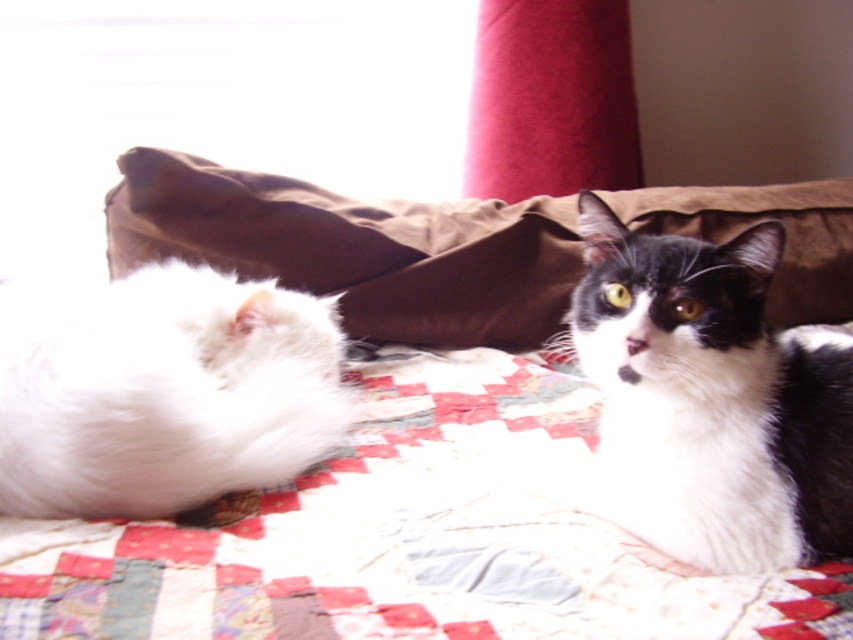
Question: Estimate the real-world distances between objects in this image. Which object is farther from the brown fabric pillow at center?

Choices:
 (A) white fluffy cat at left
 (B) black and white fur cat at upper right

Answer: (B)

Question: Among these points, which one is nearest to the camera?

Choices:
 (A) (672, 348)
 (B) (294, 348)

Answer: (A)

Question: Does black and white fur cat at upper right have a lesser width compared to white fluffy cat at left?

Choices:
 (A) yes
 (B) no

Answer: (A)

Question: Is black and white fur cat at upper right below white fluffy cat at left?

Choices:
 (A) yes
 (B) no

Answer: (A)

Question: Which object is the closest to the brown fabric pillow at center?

Choices:
 (A) white fluffy cat at left
 (B) black and white fur cat at upper right

Answer: (A)

Question: Is brown fabric pillow at center below white fluffy cat at left?

Choices:
 (A) no
 (B) yes

Answer: (A)